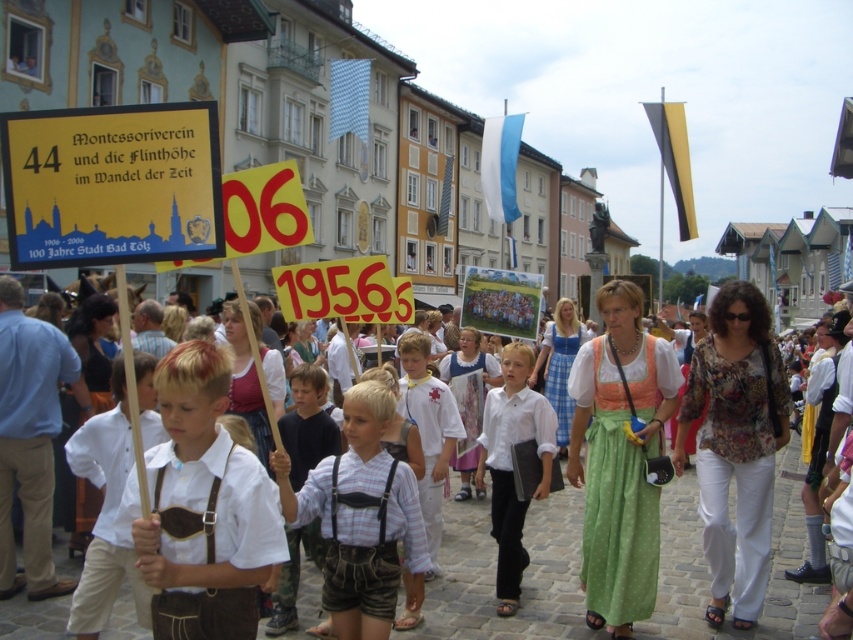
Question: Considering the relative positions of white leather suspenders at center and white cotton shirt at center in the image provided, where is white leather suspenders at center located with respect to white cotton shirt at center?

Choices:
 (A) right
 (B) left

Answer: (B)

Question: Is white leather suspenders at center in front of white striped shirt at center?

Choices:
 (A) no
 (B) yes

Answer: (B)

Question: Is white leather suspenders at center thinner than white striped shirt at center?

Choices:
 (A) no
 (B) yes

Answer: (A)

Question: Considering the real-world distances, which object is farthest from the white leather suspenders at center?

Choices:
 (A) white cotton shirt at center
 (B) white striped shirt at center

Answer: (A)

Question: Estimate the real-world distances between objects in this image. Which object is farther from the white striped shirt at center?

Choices:
 (A) white leather suspenders at center
 (B) white cotton shirt at center

Answer: (B)

Question: Estimate the real-world distances between objects in this image. Which object is closer to the white striped shirt at center?

Choices:
 (A) white leather suspenders at center
 (B) white cotton shirt at center

Answer: (A)